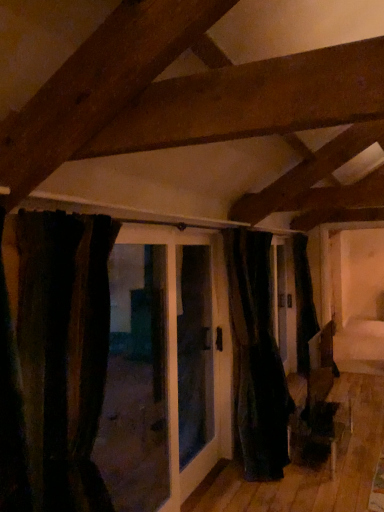
Question: Is black fabric door at center positioned before dark velvet curtain at left, which appears as the second curtain when viewed from the back?

Choices:
 (A) yes
 (B) no

Answer: (B)

Question: Is black fabric door at center shorter than dark velvet curtain at left, which is counted as the first curtain, starting from the front?

Choices:
 (A) no
 (B) yes

Answer: (A)

Question: From the image's perspective, would you say black fabric door at center is positioned over dark velvet curtain at left, which ranks as the first curtain in left-to-right order?

Choices:
 (A) no
 (B) yes

Answer: (A)

Question: Is black fabric door at center placed right next to dark velvet curtain at left, the 2th curtain from the right?

Choices:
 (A) yes
 (B) no

Answer: (B)

Question: Can you confirm if black fabric door at center is bigger than dark velvet curtain at left, which is counted as the first curtain, starting from the front?

Choices:
 (A) yes
 (B) no

Answer: (A)

Question: From the image's perspective, is black fabric door at center located above or below black velvet curtain at center, marked as the 1th curtain in a back-to-front arrangement?

Choices:
 (A) below
 (B) above

Answer: (B)

Question: In terms of width, does black fabric door at center look wider or thinner when compared to black velvet curtain at center, the second curtain from the left?

Choices:
 (A) wide
 (B) thin

Answer: (A)

Question: Is black fabric door at center bigger or smaller than black velvet curtain at center, which is the first curtain in right-to-left order?

Choices:
 (A) small
 (B) big

Answer: (A)

Question: Choose the correct answer: Is black fabric door at center inside black velvet curtain at center, the second curtain from the left, or outside it?

Choices:
 (A) inside
 (B) outside

Answer: (B)

Question: From their relative heights in the image, would you say black velvet curtain at center, marked as the 1th curtain in a back-to-front arrangement, is taller or shorter than black fabric door at center?

Choices:
 (A) tall
 (B) short

Answer: (A)

Question: Would you say black velvet curtain at center, which appears as the second curtain when viewed from the front, is inside or outside black fabric door at center?

Choices:
 (A) outside
 (B) inside

Answer: (A)

Question: Is point (266, 353) positioned closer to the camera than point (215, 334)?

Choices:
 (A) farther
 (B) closer

Answer: (B)

Question: In terms of width, does black velvet curtain at center, the second curtain from the left, look wider or thinner when compared to black fabric door at center?

Choices:
 (A) thin
 (B) wide

Answer: (A)

Question: From a real-world perspective, is black fabric door at center physically located above or below dark velvet curtain at left, which appears as the second curtain when viewed from the back?

Choices:
 (A) above
 (B) below

Answer: (B)

Question: Considering the positions of black fabric door at center and dark velvet curtain at left, which appears as the second curtain when viewed from the back, in the image, is black fabric door at center wider or thinner than dark velvet curtain at left, which appears as the second curtain when viewed from the back,?

Choices:
 (A) wide
 (B) thin

Answer: (B)